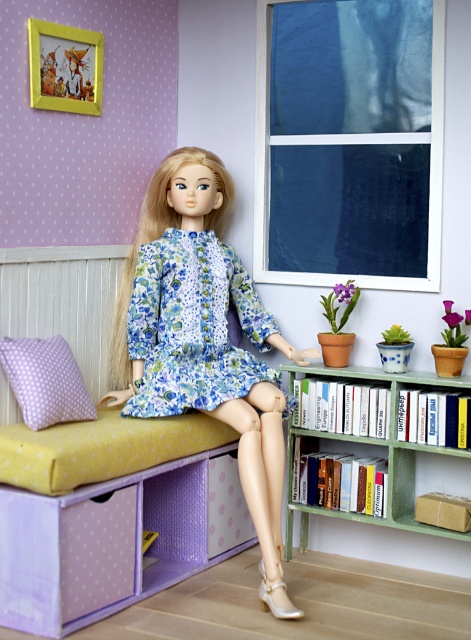
Does matte floral dress at center appear on the right side of floral fabric dress at center?

Yes, matte floral dress at center is to the right of floral fabric dress at center.

Find the location of a particular element. Image resolution: width=471 pixels, height=640 pixels. matte floral dress at center is located at coordinates (203, 339).

Describe the element at coordinates (203, 339) in the screenshot. I see `matte floral dress at center` at that location.

Does matte floral dress at center have a lesser height compared to green matte bookcase at lower right?

No, matte floral dress at center is not shorter than green matte bookcase at lower right.

Is point (259, 451) in front of point (388, 545)?

Yes, it is.

Identify the location of matte floral dress at center. This screenshot has width=471, height=640. (203, 339).

Does floral fabric dress at center have a larger size compared to green matte bookcase at lower right?

Incorrect, floral fabric dress at center is not larger than green matte bookcase at lower right.

Can you confirm if floral fabric dress at center is shorter than green matte bookcase at lower right?

Yes, floral fabric dress at center is shorter than green matte bookcase at lower right.

Describe the element at coordinates (192, 324) in the screenshot. This screenshot has height=640, width=471. I see `floral fabric dress at center` at that location.

Where is `floral fabric dress at center`? This screenshot has height=640, width=471. floral fabric dress at center is located at coordinates (192, 324).